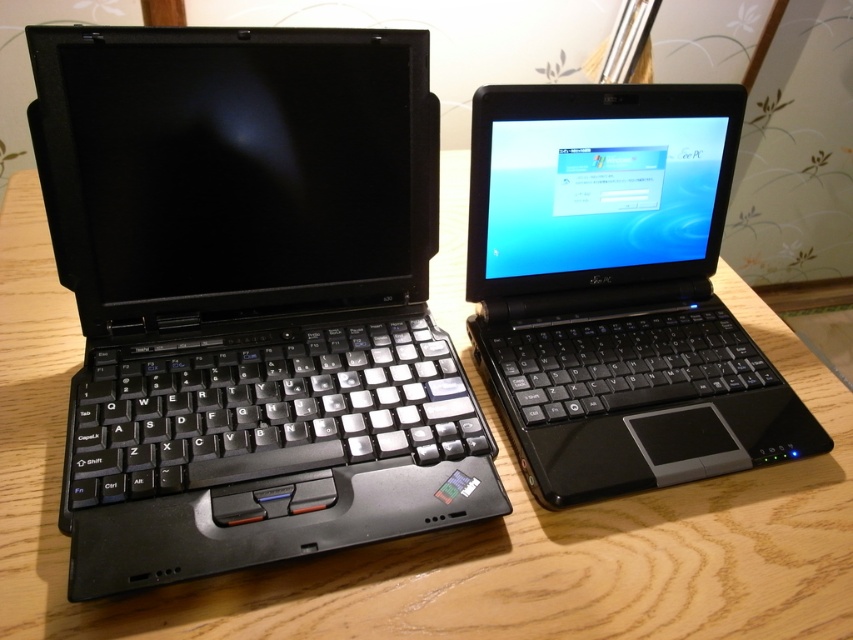
Is black matte keyboard at left to the left of black plastic laptop at center from the viewer's perspective?

Correct, you'll find black matte keyboard at left to the left of black plastic laptop at center.

Does point (247, 326) come closer to viewer compared to point (675, 144)?

Yes, it is in front of point (675, 144).

At what (x,y) coordinates should I click in order to perform the action: click on black matte keyboard at left. Please return your answer as a coordinate pair (x, y). The height and width of the screenshot is (640, 853). Looking at the image, I should click on (248, 298).

Is wooden table at center above black plastic laptop at center?

No, wooden table at center is not above black plastic laptop at center.

Consider the image. Measure the distance from wooden table at center to black plastic laptop at center.

wooden table at center is 5.78 inches away from black plastic laptop at center.

Does point (19, 248) come in front of point (553, 458)?

No, (19, 248) is behind (553, 458).

The width and height of the screenshot is (853, 640). In order to click on wooden table at center in this screenshot , I will do `click(445, 529)`.

Which is in front, point (247, 429) or point (370, 618)?

Point (370, 618)

Which of these two, black matte keyboard at left or wooden table at center, stands shorter?

black matte keyboard at left is shorter.

The image size is (853, 640). I want to click on black matte keyboard at left, so click(248, 298).

The image size is (853, 640). In order to click on black matte keyboard at left in this screenshot , I will do `click(248, 298)`.